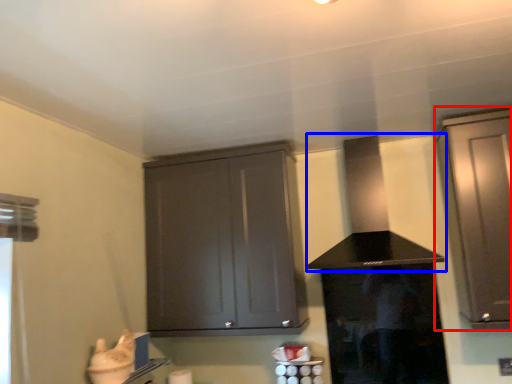
Question: Which object appears closest to the camera in this image, cabinetry (highlighted by a red box) or vent (highlighted by a blue box)?

Choices:
 (A) cabinetry
 (B) vent

Answer: (A)